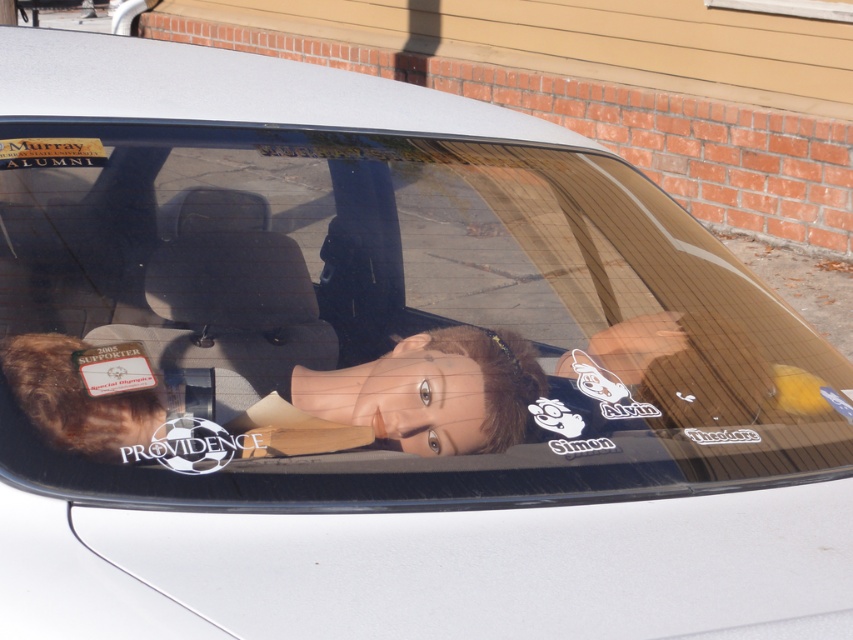
You are a delivery person who needs to place a small package on the car windshield. The package must be placed above the matte paper sticker at lower left and next to the brown plush toy at center. Is this possible given their current positions?

The brown plush toy at center is located below the matte paper sticker at lower left, so placing the package above the matte paper sticker at lower left would position it above both objects. However, the question specifies placing it next to the brown plush toy at center, which is below the sticker. Therefore, it is not possible to satisfy both requirements simultaneously.

You are a passenger in the car and want to hand a gift to the driver. The gift is a small box that needs to be placed between the brown plush toy at center and the matte paper sticker at lower left. Is there enough space between them to place the box?

The brown plush toy at center is positioned on the right side of matte paper sticker at lower left, so there is space between them to place the box.

You are a passenger in the back seat of the car shown. You want to place a small gift on the dashboard directly in front of you. The dashboard is located at point (432, 392). However, there is already an object there. What is the object currently occupying the space where you want to place your gift?

The brown plush toy at center is located at point (432, 392), so that is the object currently occupying the space where you want to place your gift.